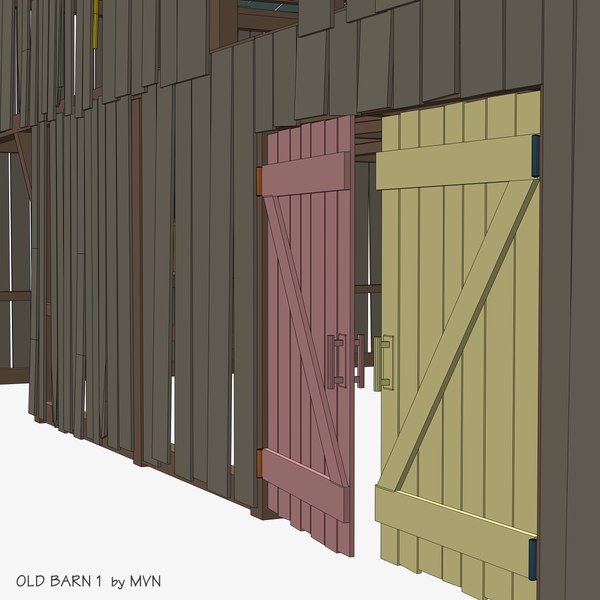
The height and width of the screenshot is (600, 600). What are the coordinates of `yellow door` in the screenshot? It's located at (450, 436).